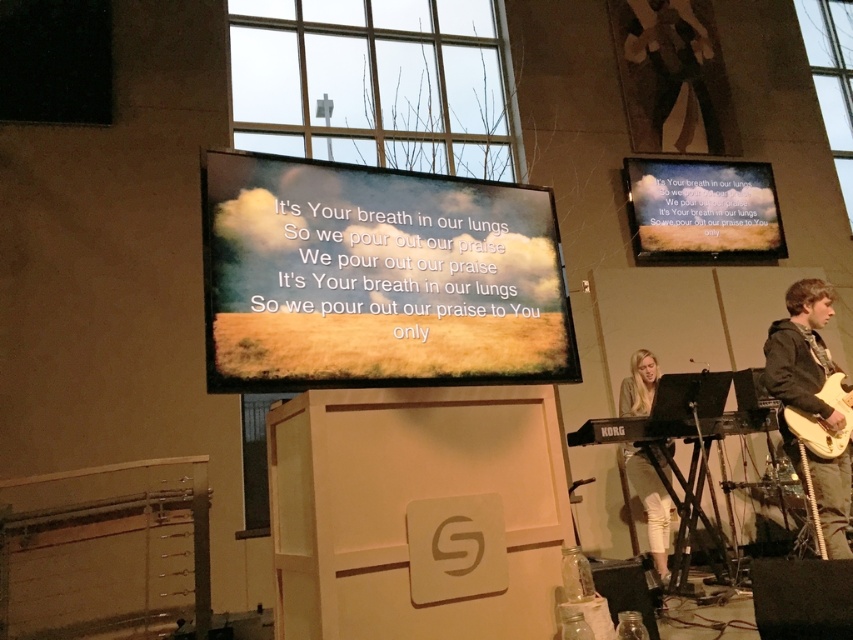
You are an event organizer setting up for a presentation. You need to position a speaker that requires a 1.2 meter clearance from the matte black projection screen at upper right. Where should you place the speaker relative to the screen?

The matte black projection screen at upper right is located at point (x=701, y=211). To ensure the speaker has a 1.2 meter clearance from the screen, place it at least 1.2 meters away from the screen in any direction, maintaining the required distance for optimal sound projection.

You are standing on the stage facing the audience. You need to place a new microphone stand that must be positioned exactly at the center of the stage. However, there is already a matte black projection screen at upper right. Where should you place the microphone stand so it doesn not interfere with the projection screen?

The microphone stand should be placed at the center of the stage, which is different from the position of the matte black projection screen at upper right located at point [701,211]. Since the screen is at the upper right corner, placing the microphone at the center will keep it away from the screen.